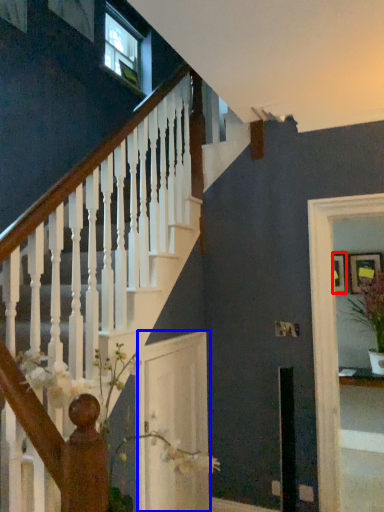
Question: Which point is closer to the camera, picture frame (highlighted by a red box) or glass door (highlighted by a blue box)?

Choices:
 (A) picture frame
 (B) glass door

Answer: (B)